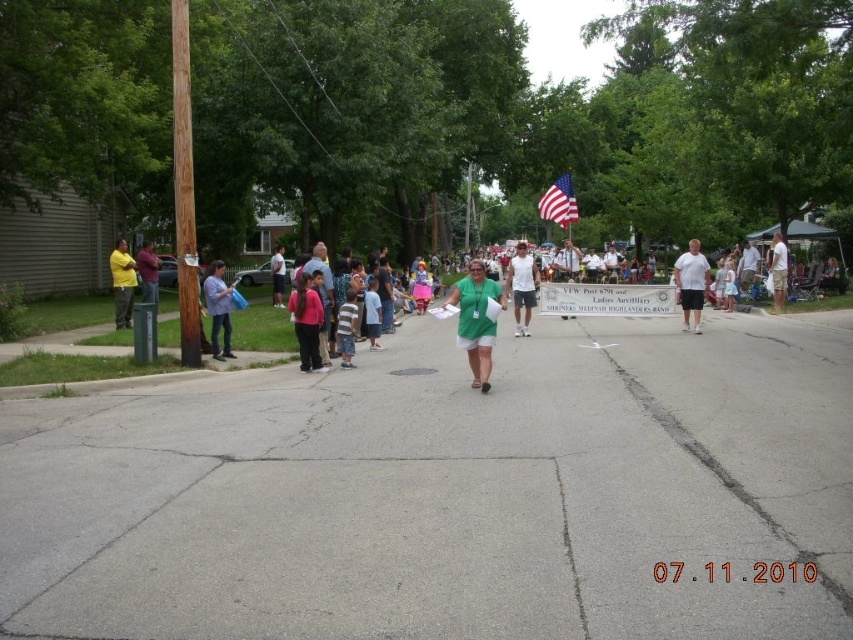
Question: Which object is the closest to the matte pink shirt at center?

Choices:
 (A) american flag at center
 (B) yellow shirt at left
 (C) white cotton tank top at center

Answer: (B)

Question: Does matte yellow shirt at left appear on the left side of pink fabric shirt at center?

Choices:
 (A) no
 (B) yes

Answer: (B)

Question: Estimate the real-world distances between objects in this image. Which object is farther from the white cotton t-shirt at center?

Choices:
 (A) white cotton shirt at center
 (B) matte pink shirt at center
 (C) yellow shirt at left
 (D) white paper banner at center

Answer: (C)

Question: Among these points, which one is farthest from the camera?

Choices:
 (A) (521, 250)
 (B) (279, 273)
 (C) (119, 259)

Answer: (B)

Question: Does white paper banner at center appear on the left side of white cotton shirt at center?

Choices:
 (A) no
 (B) yes

Answer: (B)

Question: Can you confirm if white paper banner at center is positioned to the left of denim jacket at left?

Choices:
 (A) yes
 (B) no

Answer: (B)